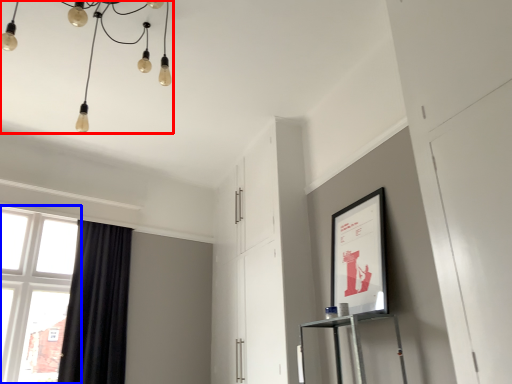
Question: Which of the following is the farthest to the observer, lamp (highlighted by a red box) or window (highlighted by a blue box)?

Choices:
 (A) lamp
 (B) window

Answer: (B)